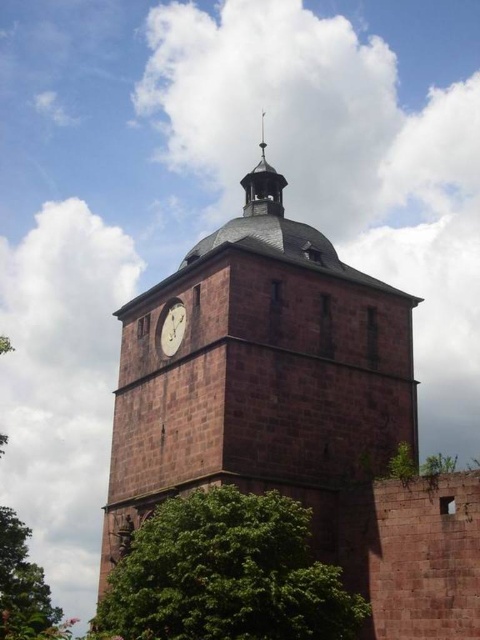
You are standing in front of the historic tower and notice a green leafy tree at lower center. Based on its coordinates, can you determine if the tree is closer to the left or right side of the tower?

The green leafy tree at lower center is located at point [226,573]. Since the x coordinate is 0.897, which is closer to 1.0, the tree is positioned more to the right side of the tower.

You are standing in front of the historic tower and notice the green leafy tree at left and the white glossy clock at center. Which object is positioned more to the east if the tower faces north?

The green leafy tree at left is positioned more to the east because when facing north, left would correspond to the east direction.